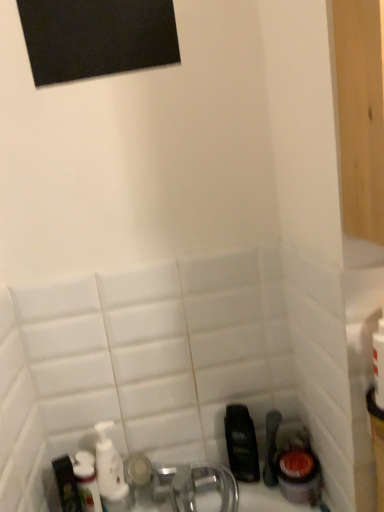
Question: From the image's perspective, is white glossy mouthwash at lower left, the 1th mouthwash when ordered from left to right, over white glossy bottle at lower left?

Choices:
 (A) no
 (B) yes

Answer: (A)

Question: Can you confirm if white glossy mouthwash at lower left, the second mouthwash from the right, is shorter than white glossy bottle at lower left?

Choices:
 (A) yes
 (B) no

Answer: (B)

Question: Is white glossy mouthwash at lower left, the second mouthwash from the right, taller than white glossy bottle at lower left?

Choices:
 (A) yes
 (B) no

Answer: (A)

Question: From a real-world perspective, is white glossy mouthwash at lower left, the 1th mouthwash when ordered from left to right, located higher than white glossy bottle at lower left?

Choices:
 (A) yes
 (B) no

Answer: (B)

Question: Can you confirm if white glossy mouthwash at lower left, the second mouthwash from the right, is positioned to the left of white glossy bottle at lower left?

Choices:
 (A) no
 (B) yes

Answer: (A)

Question: Would you say white glossy mouthwash at lower left, the second mouthwash from the right, contains white glossy bottle at lower left?

Choices:
 (A) yes
 (B) no

Answer: (B)

Question: Is dark brown plastic mouthwash at lower right, which is the first mouthwash from right to left, touching white glossy mouthwash at lower left, the second mouthwash from the right?

Choices:
 (A) yes
 (B) no

Answer: (B)

Question: Is dark brown plastic mouthwash at lower right, the second mouthwash positioned from the left, outside white glossy mouthwash at lower left, the 1th mouthwash when ordered from left to right?

Choices:
 (A) yes
 (B) no

Answer: (A)

Question: From a real-world perspective, is dark brown plastic mouthwash at lower right, the second mouthwash positioned from the left, on white glossy mouthwash at lower left, the second mouthwash from the right?

Choices:
 (A) no
 (B) yes

Answer: (A)

Question: Does dark brown plastic mouthwash at lower right, which is the first mouthwash from right to left, come in front of white glossy mouthwash at lower left, the 1th mouthwash when ordered from left to right?

Choices:
 (A) no
 (B) yes

Answer: (A)

Question: Does dark brown plastic mouthwash at lower right, which is the first mouthwash from right to left, have a larger size compared to white glossy mouthwash at lower left, the second mouthwash from the right?

Choices:
 (A) yes
 (B) no

Answer: (B)

Question: Is dark brown plastic mouthwash at lower right, which is the first mouthwash from right to left, positioned with its back to white glossy mouthwash at lower left, the 1th mouthwash when ordered from left to right?

Choices:
 (A) no
 (B) yes

Answer: (A)

Question: From a real-world perspective, does white glossy mouthwash at lower left, the 1th mouthwash when ordered from left to right, stand above dark brown plastic mouthwash at lower right, which is the first mouthwash from right to left?

Choices:
 (A) no
 (B) yes

Answer: (B)